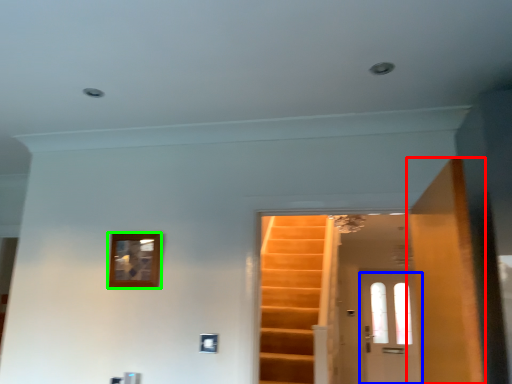
Question: Based on their relative distances, which object is farther from door (highlighted by a red box)? Choose from door (highlighted by a blue box) and picture frame (highlighted by a green box).

Choices:
 (A) door
 (B) picture frame

Answer: (A)